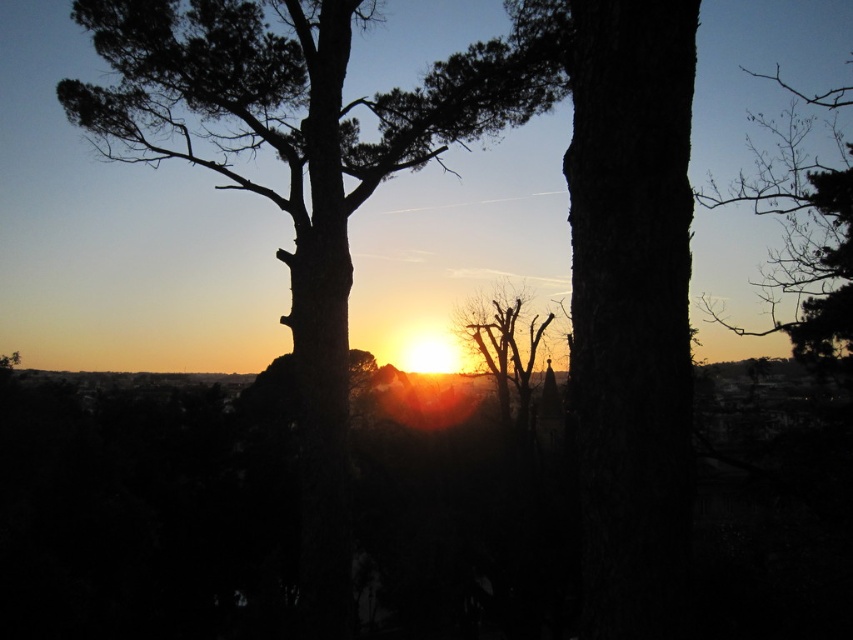
Which is behind, point (779, 250) or point (509, 388)?

Positioned behind is point (509, 388).

Who is shorter, bare branches at upper right or bare branches at center?

With less height is bare branches at center.

Who is more distant from viewer, (815, 202) or (525, 396)?

The point (525, 396) is more distant.

Locate an element on the screen. The height and width of the screenshot is (640, 853). bare branches at upper right is located at coordinates (804, 230).